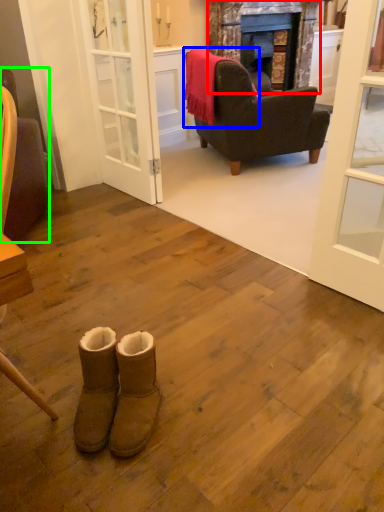
Question: Which is nearer to the fireplace (highlighted by a red box)? blanket (highlighted by a blue box) or chair (highlighted by a green box).

Choices:
 (A) blanket
 (B) chair

Answer: (A)